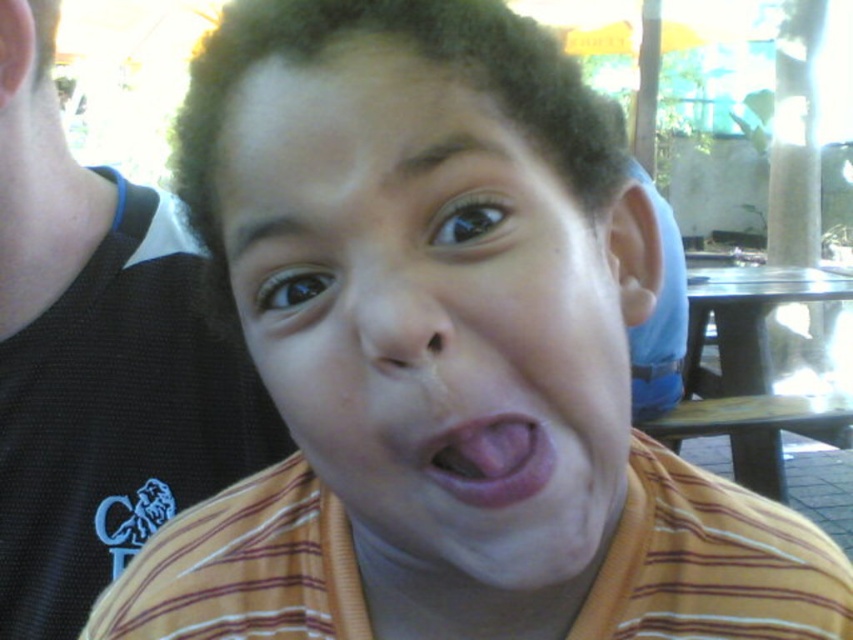
Is point (10, 65) less distant than point (497, 493)?

That is False.

Who is positioned more to the right, black mesh tank top at left or pink flesh at center?

Positioned to the right is pink flesh at center.

Between point (151, 308) and point (511, 438), which one is positioned in front?

Point (511, 438) is in front.

This screenshot has height=640, width=853. In order to click on black mesh tank top at left in this screenshot , I will do `click(99, 358)`.

Based on the photo, between yellow striped shirt at center and black mesh tank top at left, which one appears on the left side from the viewer's perspective?

Positioned to the left is black mesh tank top at left.

Does yellow striped shirt at center appear on the left side of black mesh tank top at left?

No, yellow striped shirt at center is not to the left of black mesh tank top at left.

Which is in front, point (293, 74) or point (15, 204)?

Point (293, 74) is more forward.

Locate an element on the screen. yellow striped shirt at center is located at coordinates (433, 314).

Does yellow striped shirt at center have a lesser height compared to pink flesh at center?

No.

This screenshot has height=640, width=853. I want to click on yellow striped shirt at center, so click(433, 314).

What do you see at coordinates (433, 314) in the screenshot? I see `yellow striped shirt at center` at bounding box center [433, 314].

The width and height of the screenshot is (853, 640). Find the location of `yellow striped shirt at center`. yellow striped shirt at center is located at coordinates coord(433,314).